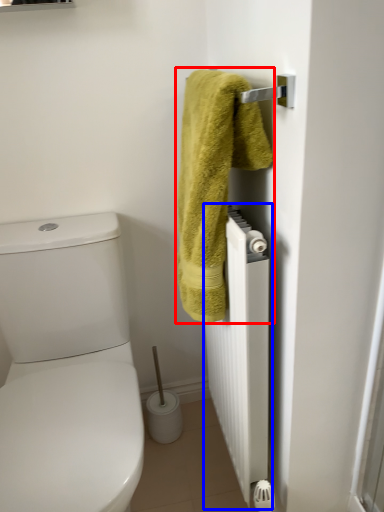
Question: Which point is closer to the camera, towel (highlighted by a red box) or radiator (highlighted by a blue box)?

Choices:
 (A) towel
 (B) radiator

Answer: (A)